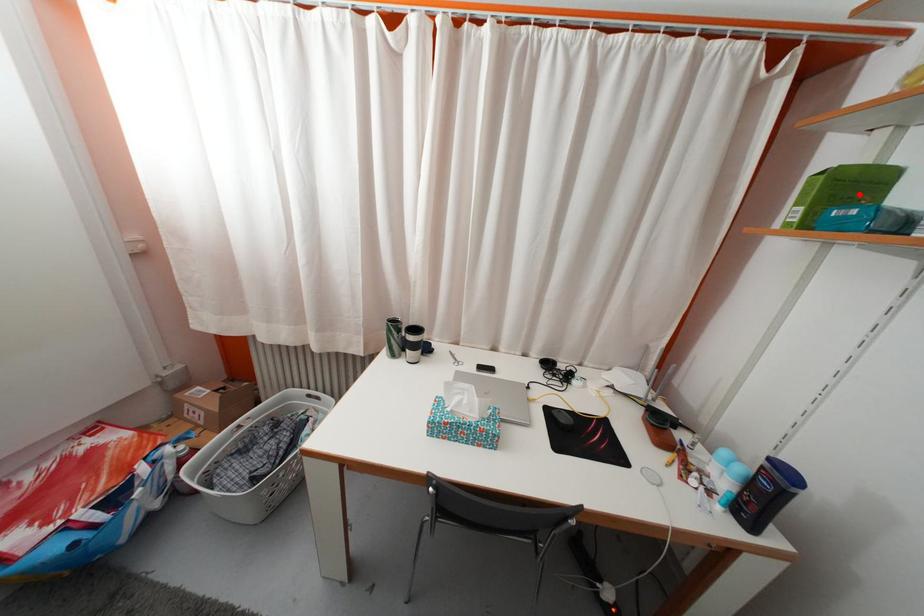
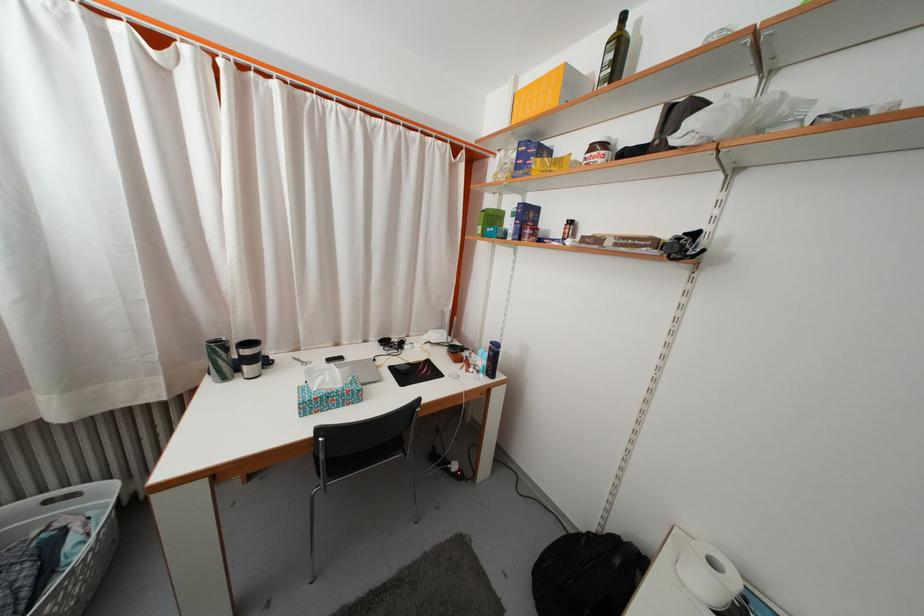
Where in the second image is the point corresponding to the highlighted location from the first image?

(500, 225)